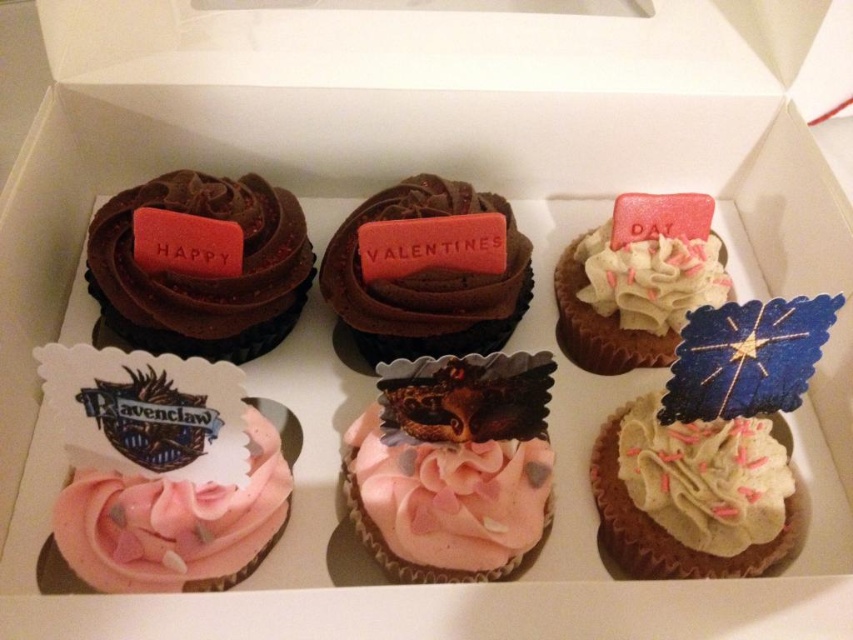
You are holding a 1.2 meter long ruler and want to measure the distance from your position to the point marked at coordinates point (294, 205). Can your ruler reach that point?

The distance between you and point (294, 205) is 1.17 meters. Since your ruler is 1.2 meters long, it can reach the point as it is slightly longer than the distance required.

Consider the image. You are planning to decorate a cake for a party and need to choose between the pink buttercream at center and the pink frosted cupcake at upper right. Based on their sizes, which one would be better for a larger decoration?

The pink frosted cupcake at upper right is larger in size compared to the pink buttercream at center, so it would be better for a larger decoration.

Please describe the location of the pink buttercream at center in the cupcake arrangement using Cartesian coordinates. The coordinate system has the origin at the bottom left corner of the box, with the x and y axes increasing to the right and up respectively.

The pink buttercream at center is located at Cartesian coordinates point (445, 499).